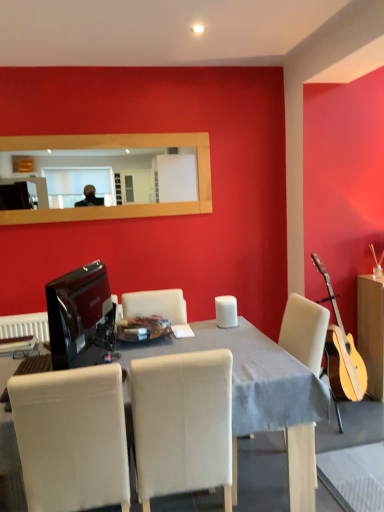
Image resolution: width=384 pixels, height=512 pixels. What do you see at coordinates (72, 438) in the screenshot?
I see `white fabric chair at lower left, the second chair viewed from the right` at bounding box center [72, 438].

The width and height of the screenshot is (384, 512). What do you see at coordinates (371, 331) in the screenshot? I see `wooden cabinet at right` at bounding box center [371, 331].

This screenshot has height=512, width=384. Find the location of `beige fabric chair at center, which is the first chair in right-to-left order`. beige fabric chair at center, which is the first chair in right-to-left order is located at coordinates (182, 423).

This screenshot has height=512, width=384. What do you see at coordinates (226, 311) in the screenshot?
I see `white matte speaker at center` at bounding box center [226, 311].

Describe the element at coordinates (80, 313) in the screenshot. This screenshot has height=512, width=384. I see `black glossy television at left` at that location.

Identify the location of white fabric chair at lower left, which is the 1th chair in left-to-right order. The image size is (384, 512). (72, 438).

This screenshot has height=512, width=384. Find the location of `television located behind the light beige fabric table at center`. television located behind the light beige fabric table at center is located at coordinates (80, 313).

From a real-world perspective, is black glossy television at left over light beige fabric table at center?

Yes.

Can you confirm if black glossy television at left is smaller than light beige fabric table at center?

Yes, black glossy television at left is smaller than light beige fabric table at center.

Considering the positions of objects wooden cabinet at right and black glossy television at left in the image provided, who is more to the left, wooden cabinet at right or black glossy television at left?

From the viewer's perspective, black glossy television at left appears more on the left side.

From a real-world perspective, is wooden cabinet at right positioned above or below black glossy television at left?

wooden cabinet at right is below black glossy television at left.

What's the angular difference between wooden cabinet at right and black glossy television at left's facing directions?

There is a 104-degree angle between the facing directions of wooden cabinet at right and black glossy television at left.

Can you confirm if light beige fabric table at center is thinner than wooden cabinet at right?

No, light beige fabric table at center is not thinner than wooden cabinet at right.

This screenshot has height=512, width=384. What are the coordinates of `desk that is under the wooden cabinet at right (from a real-world perspective)` in the screenshot? It's located at tap(262, 395).

Measure the distance from light beige fabric table at center to wooden cabinet at right.

light beige fabric table at center and wooden cabinet at right are 3.95 feet apart from each other.

Which is more to the left, light beige fabric table at center or wooden cabinet at right?

light beige fabric table at center.

From their relative heights in the image, would you say beige fabric chair at center, which is the first chair in right-to-left order, is taller or shorter than white matte speaker at center?

beige fabric chair at center, which is the first chair in right-to-left order, is taller than white matte speaker at center.

Which is in front, point (219, 472) or point (228, 316)?

Positioned in front is point (219, 472).

How many degrees apart are the facing directions of beige fabric chair at center, acting as the 2th chair starting from the left, and white matte speaker at center?

90 degrees.

Is beige fabric chair at center, acting as the 2th chair starting from the left, bigger or smaller than white matte speaker at center?

Clearly, beige fabric chair at center, acting as the 2th chair starting from the left, is larger in size than white matte speaker at center.

Which object is closer to the camera, clear glass plate at center or beige fabric chair at center, acting as the 2th chair starting from the left?

beige fabric chair at center, acting as the 2th chair starting from the left, is closer to the camera.

In terms of height, does clear glass plate at center look taller or shorter compared to beige fabric chair at center, which is the first chair in right-to-left order?

In the image, clear glass plate at center appears to be shorter than beige fabric chair at center, which is the first chair in right-to-left order.

Between clear glass plate at center and beige fabric chair at center, acting as the 2th chair starting from the left, which one has smaller width?

clear glass plate at center.

Is clear glass plate at center not inside beige fabric chair at center, which is the first chair in right-to-left order?

Yes, clear glass plate at center is not within beige fabric chair at center, which is the first chair in right-to-left order.

Who is smaller, white matte speaker at center or beige fabric chair at center, which is the first chair in right-to-left order?

Smaller between the two is white matte speaker at center.

Which object is more forward, white matte speaker at center or beige fabric chair at center, which is the first chair in right-to-left order?

Positioned in front is beige fabric chair at center, which is the first chair in right-to-left order.

From the image's perspective, is white matte speaker at center above or below beige fabric chair at center, which is the first chair in right-to-left order?

white matte speaker at center is situated higher than beige fabric chair at center, which is the first chair in right-to-left order, in the image.

From a real-world perspective, which object stands above the other?

In real-world perspective, wooden frame mirror at upper center is above.

Are wooden frame mirror at upper center and beige fabric chair at center, which is the first chair in right-to-left order, far apart?

Yes, wooden frame mirror at upper center and beige fabric chair at center, which is the first chair in right-to-left order, are located far from each other.

Considering the sizes of objects wooden frame mirror at upper center and beige fabric chair at center, which is the first chair in right-to-left order, in the image provided, who is shorter, wooden frame mirror at upper center or beige fabric chair at center, which is the first chair in right-to-left order,?

Standing shorter between the two is wooden frame mirror at upper center.

Is wooden frame mirror at upper center positioned with its back to beige fabric chair at center, acting as the 2th chair starting from the left?

That's not correct — wooden frame mirror at upper center is not looking away from beige fabric chair at center, acting as the 2th chair starting from the left.

Where is `television above the light beige fabric table at center (from a real-world perspective)`? television above the light beige fabric table at center (from a real-world perspective) is located at coordinates (80, 313).

Find the location of a particular element. The image size is (384, 512). cabinetry that is on the right side of black glossy television at left is located at coordinates (371, 331).

Considering their positions, is white matte speaker at center positioned further to light beige fabric table at center than wooden frame mirror at upper center?

wooden frame mirror at upper center lies further to light beige fabric table at center than the other object.

From the image, which object appears to be nearer to white matte speaker at center, beige fabric chair at center, which is the first chair in right-to-left order, or light beige fabric table at center?

light beige fabric table at center lies closer to white matte speaker at center than the other object.

Looking at the image, which one is located closer to beige fabric chair at center, acting as the 2th chair starting from the left, black glossy television at left or wooden frame mirror at upper center?

black glossy television at left.

Looking at the image, which one is located closer to wooden frame mirror at upper center, black glossy television at left or beige fabric chair at center, acting as the 2th chair starting from the left?

black glossy television at left.

Estimate the real-world distances between objects in this image. Which object is further from light beige fabric table at center, clear glass plate at center or white matte speaker at center?

white matte speaker at center is positioned further to the anchor light beige fabric table at center.

Looking at the image, which one is located closer to wooden cabinet at right, black glossy television at left or white matte speaker at center?

Answer: white matte speaker at center.

From the image, which object appears to be farther from wooden cabinet at right, clear glass plate at center or black glossy television at left?

black glossy television at left.

Looking at the image, which one is located closer to light beige fabric table at center, wooden frame mirror at upper center or wooden cabinet at right?

wooden cabinet at right.

The height and width of the screenshot is (512, 384). Identify the location of coffee cup situated between black glossy television at left and wooden cabinet at right from left to right. (226, 311).

At what (x,y) coordinates should I click in order to perform the action: click on television positioned between white fabric chair at lower left, the second chair viewed from the right, and wooden frame mirror at upper center from near to far. Please return your answer as a coordinate pair (x, y). Image resolution: width=384 pixels, height=512 pixels. Looking at the image, I should click on (80, 313).

Find the location of a particular element. chair that lies between black glossy television at left and white fabric chair at lower left, which is the 1th chair in left-to-right order, from top to bottom is located at coordinates (182, 423).

Locate an element on the screen. chair between clear glass plate at center and wooden cabinet at right is located at coordinates (182, 423).